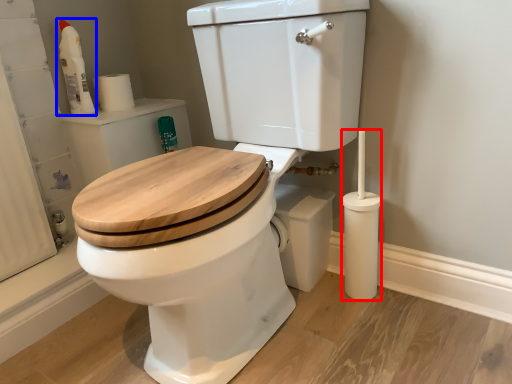
Question: Which object is closer to the camera taking this photo, brush (highlighted by a red box) or cleaning product (highlighted by a blue box)?

Choices:
 (A) brush
 (B) cleaning product

Answer: (A)